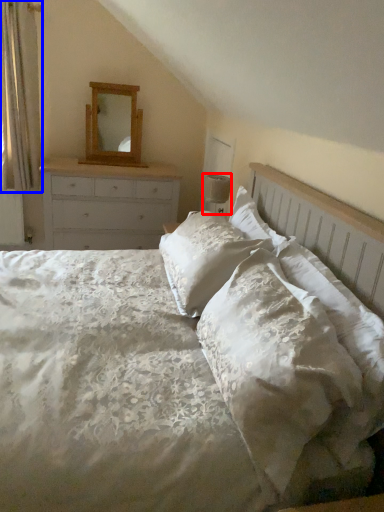
Question: Which object appears closest to the camera in this image, lamp (highlighted by a red box) or curtain (highlighted by a blue box)?

Choices:
 (A) lamp
 (B) curtain

Answer: (A)